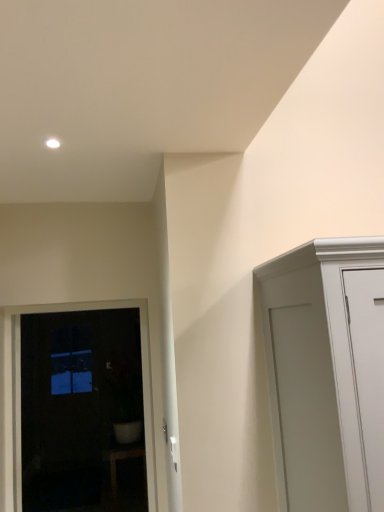
Question: Would you consider white glossy pot at lower left to be distant from dark glass door at left?

Choices:
 (A) yes
 (B) no

Answer: (A)

Question: Would you say white glossy pot at lower left is outside dark glass door at left?

Choices:
 (A) yes
 (B) no

Answer: (A)

Question: Is white glossy pot at lower left next to dark glass door at left?

Choices:
 (A) no
 (B) yes

Answer: (A)

Question: From a real-world perspective, does white glossy pot at lower left sit lower than dark glass door at left?

Choices:
 (A) yes
 (B) no

Answer: (A)

Question: Does white glossy pot at lower left turn towards dark glass door at left?

Choices:
 (A) yes
 (B) no

Answer: (B)

Question: Does white glossy pot at lower left have a larger size compared to dark glass door at left?

Choices:
 (A) yes
 (B) no

Answer: (A)

Question: From a real-world perspective, does dark glass door at left sit lower than white glossy pot at lower left?

Choices:
 (A) yes
 (B) no

Answer: (B)

Question: Is the depth of dark glass door at left greater than that of white glossy pot at lower left?

Choices:
 (A) yes
 (B) no

Answer: (B)

Question: Is dark glass door at left oriented towards white glossy pot at lower left?

Choices:
 (A) yes
 (B) no

Answer: (B)

Question: From the image's perspective, is dark glass door at left under white glossy pot at lower left?

Choices:
 (A) no
 (B) yes

Answer: (A)

Question: Does dark glass door at left appear on the right side of white glossy pot at lower left?

Choices:
 (A) no
 (B) yes

Answer: (A)

Question: Is dark glass door at left directly adjacent to white glossy pot at lower left?

Choices:
 (A) yes
 (B) no

Answer: (B)

Question: From their relative heights in the image, would you say white glossy pot at lower left is taller or shorter than dark glass door at left?

Choices:
 (A) short
 (B) tall

Answer: (A)